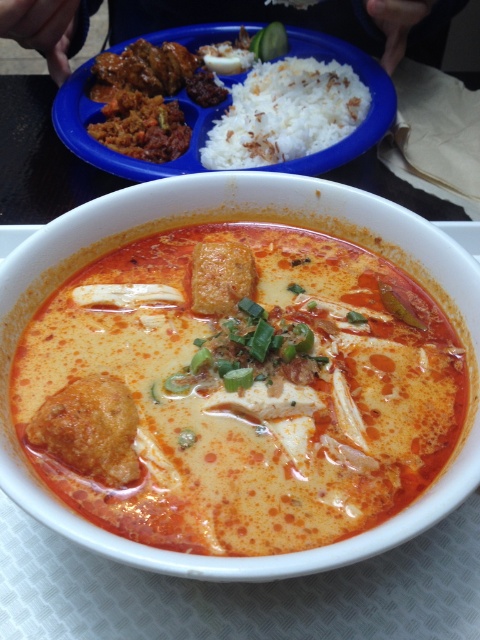
You are a food critic evaluating the layout of this meal. The creamy orange soup at center and the white polished rice at upper center are two key components. Based on their positions, which dish is located to the left of the other?

The creamy orange soup at center is positioned on the left side of white polished rice at upper center, so the soup is to the left of the rice.

You are a food photographer who needs to adjust the lighting to ensure the white polished rice at upper center is well lit. Given that the rice is 4.86 feet away from the camera, what is the minimum distance you should position the light source to effectively illuminate it?

The white polished rice at upper center is 4.86 feet from the camera. To effectively illuminate it, the light source should be positioned at least 4.86 feet away from the rice to ensure proper lighting coverage.